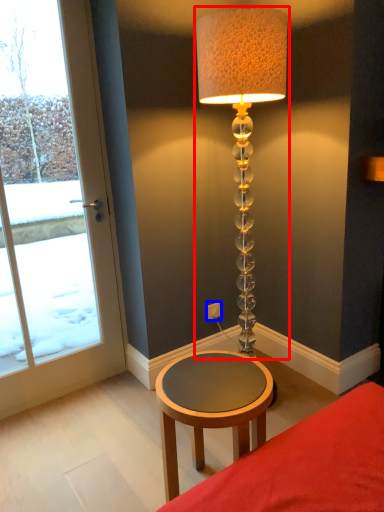
Question: Which object appears farthest to the camera in this image, lamp (highlighted by a red box) or electric outlet (highlighted by a blue box)?

Choices:
 (A) lamp
 (B) electric outlet

Answer: (B)